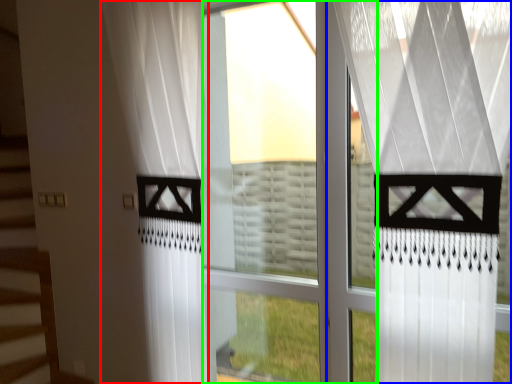
Question: Considering the real-world distances, which object is closest to curtain (highlighted by a red box)? curtain (highlighted by a blue box) or glass window (highlighted by a green box).

Choices:
 (A) curtain
 (B) glass window

Answer: (B)